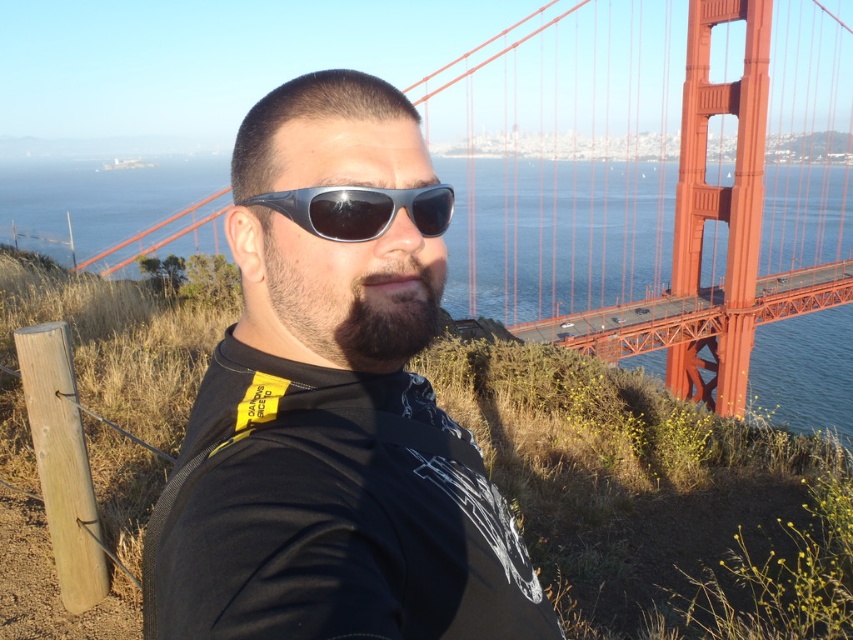
Question: Which of these objects is positioned farthest from the sunglasses at center?

Choices:
 (A) black matte sunglasses at center
 (B) dark brown fuzzy beard at center
 (C) red painted steel golden gate bridge at center

Answer: (C)

Question: Does dark brown fuzzy beard at center appear over sunglasses at center?

Choices:
 (A) yes
 (B) no

Answer: (B)

Question: Estimate the real-world distances between objects in this image. Which object is farther from the sunglasses at center?

Choices:
 (A) black matte sunglasses at center
 (B) dark brown fuzzy beard at center
 (C) red painted steel golden gate bridge at center

Answer: (C)

Question: Among these points, which one is nearest to the camera?

Choices:
 (A) 442,198
 (B) 247,627
 (C) 625,90
 (D) 434,292

Answer: (B)

Question: Is dark brown fuzzy beard at center positioned before sunglasses at center?

Choices:
 (A) yes
 (B) no

Answer: (B)

Question: Observing the image, what is the correct spatial positioning of black matte sunglasses at center in reference to dark brown fuzzy beard at center?

Choices:
 (A) below
 (B) above

Answer: (A)